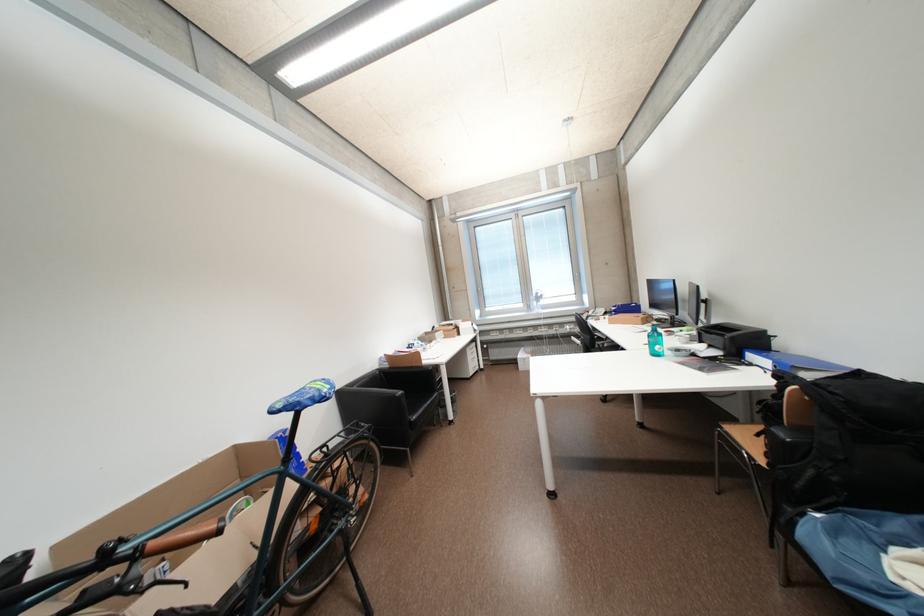
Where is `black brake lever`? This screenshot has width=924, height=616. black brake lever is located at coordinates (123, 586).